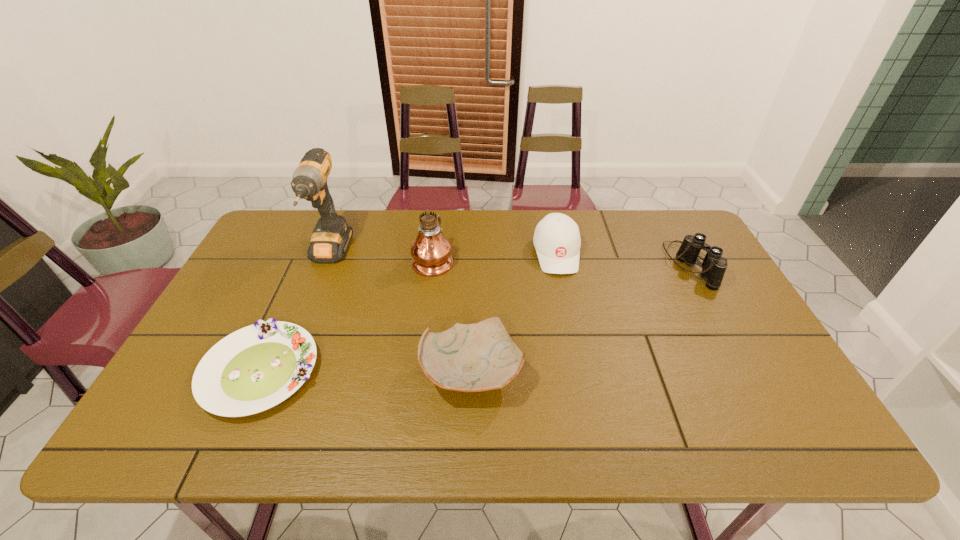
Identify the location of vacant space that satisfies the following two spatial constraints: 1. with the drill bit of the drill facing forward; 2. on the right side of the oil lamp. (327, 259).

Find the location of a particular element. free space that satisfies the following two spatial constraints: 1. on the back side of the binoculars; 2. on the right side of the shortest object is located at coordinates (308, 266).

In order to click on vacant area that satisfies the following two spatial constraints: 1. with the drill bit of the rightmost object facing forward; 2. on the left side of the drill in this screenshot , I will do `click(324, 266)`.

At what (x,y) coordinates should I click in order to perform the action: click on free point that satisfies the following two spatial constraints: 1. with the drill bit of the rightmost object facing forward; 2. on the left side of the drill. Please return your answer as a coordinate pair (x, y). Image resolution: width=960 pixels, height=540 pixels. Looking at the image, I should click on (324, 266).